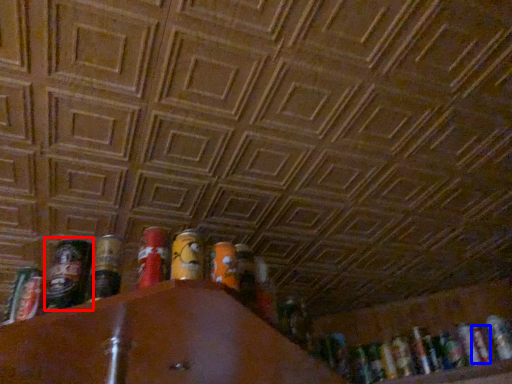
Question: Which object appears farthest to the camera in this image, beer (highlighted by a red box) or beer (highlighted by a blue box)?

Choices:
 (A) beer
 (B) beer

Answer: (B)